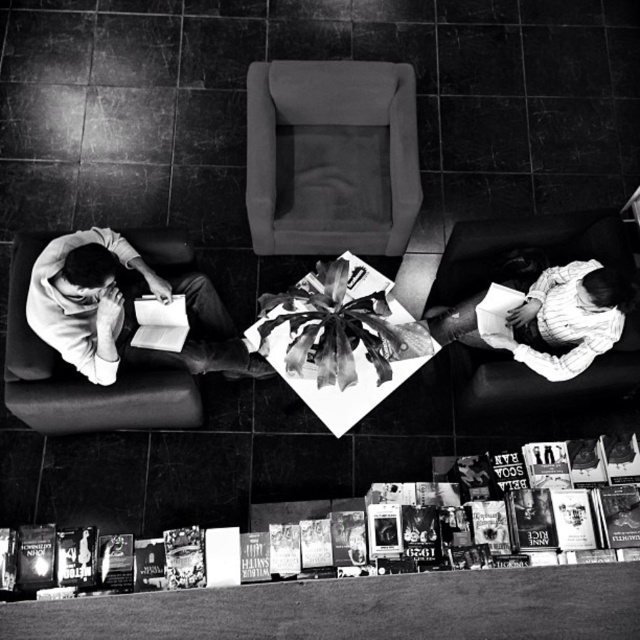
You are a photographer wanting to capture a closeup of the smooth white shirt at left without including the soft gray fabric chair at center in the frame. Based on their positions, is this possible?

The smooth white shirt at left is behind the soft gray fabric chair at center, so it is not possible to capture the smooth white shirt at left without including the soft gray fabric chair at center in the frame.

You are a photographer standing in front of the image. You notice the smooth white shirt at left and the soft fabric couch at lower right. Which object is positioned closer to you?

The smooth white shirt at left is closer to the viewer than the soft fabric couch at lower right.

You are a photographer standing above the scene. You notice the smooth white shirt at left and the soft fabric couch at lower right. Which object is located to the left of the other?

The smooth white shirt at left is positioned on the left side of the soft fabric couch at lower right.